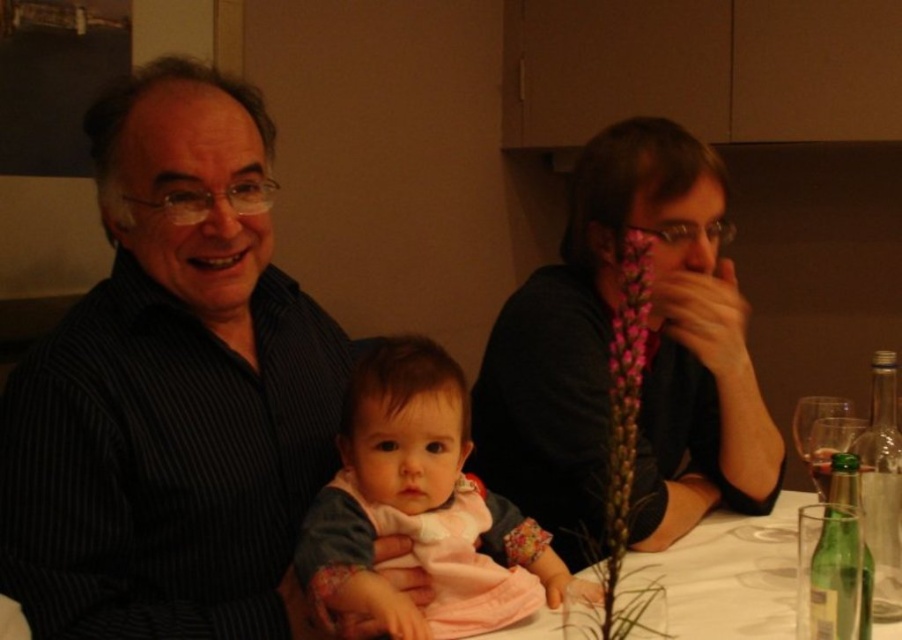
Question: Which of the following is the farthest from the observer?

Choices:
 (A) clear glass wine glass at right
 (B) transparent glass at upper right
 (C) pink fabric baby at center
 (D) white paper table at center

Answer: (B)

Question: Which point is farther to the camera?

Choices:
 (A) white paper table at center
 (B) clear glass wine glass at right

Answer: (A)

Question: Which object is closer to the camera taking this photo?

Choices:
 (A) white paper table at center
 (B) dark striped shirt at left
 (C) clear glass wine glass at right

Answer: (B)

Question: Is pink fabric baby at center to the left of clear glass wine glass at right from the viewer's perspective?

Choices:
 (A) yes
 (B) no

Answer: (A)

Question: Observing the image, what is the correct spatial positioning of dark striped shirt at left in reference to clear glass wine glass at right?

Choices:
 (A) left
 (B) right

Answer: (A)

Question: Does pink fabric baby at center lie behind transparent glass at upper right?

Choices:
 (A) no
 (B) yes

Answer: (A)